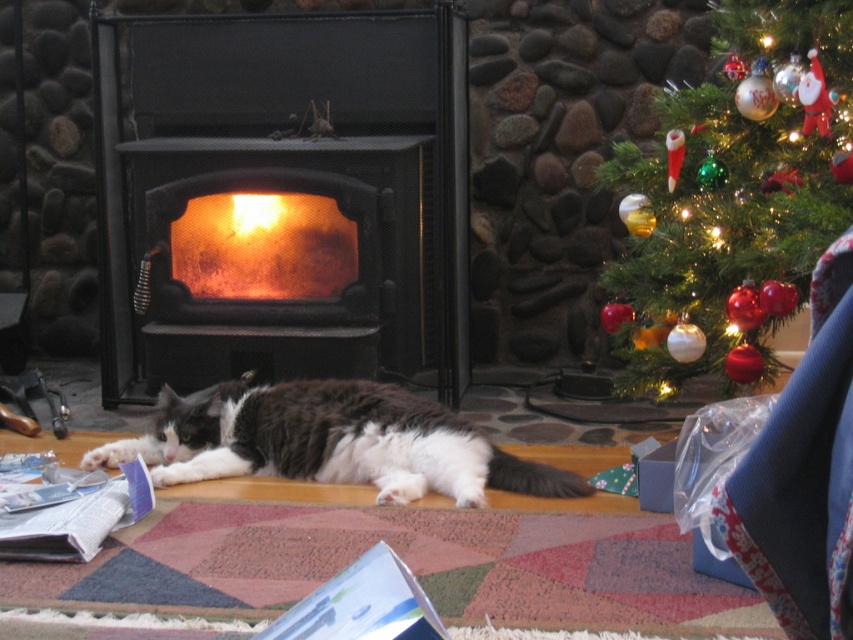
Between shiny glass ornaments at upper right and fluffy white and gray cat at center, which one appears on the right side from the viewer's perspective?

shiny glass ornaments at upper right

Is point (790, 184) positioned in front of point (368, 419)?

Yes, it is in front of point (368, 419).

Identify the location of shiny glass ornaments at upper right. The image size is (853, 640). (735, 195).

Is the position of black matte fireplace at center less distant than that of shiny glass ornaments at upper right?

No, black matte fireplace at center is behind shiny glass ornaments at upper right.

Between point (450, 273) and point (804, 76), which one is positioned in front?

Point (804, 76) is more forward.

At what (x,y) coordinates should I click in order to perform the action: click on black matte fireplace at center. Please return your answer as a coordinate pair (x, y). Looking at the image, I should click on (282, 198).

How distant is shiny glass ornaments at upper right from orange glassy fire at center?

shiny glass ornaments at upper right is 1.21 meters away from orange glassy fire at center.

Does shiny glass ornaments at upper right have a greater height compared to orange glassy fire at center?

Yes, shiny glass ornaments at upper right is taller than orange glassy fire at center.

Locate an element on the screen. shiny glass ornaments at upper right is located at coordinates (735, 195).

Locate an element on the screen. shiny glass ornaments at upper right is located at coordinates (735, 195).